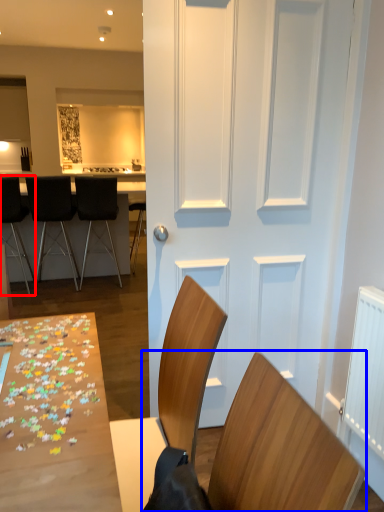
Question: Which point is further to the camera, chair (highlighted by a red box) or chair (highlighted by a blue box)?

Choices:
 (A) chair
 (B) chair

Answer: (A)